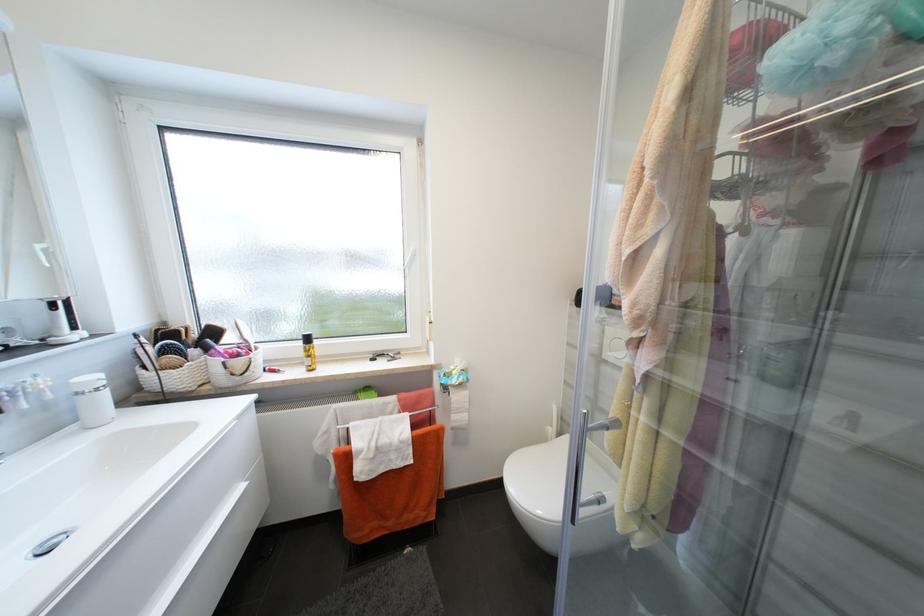
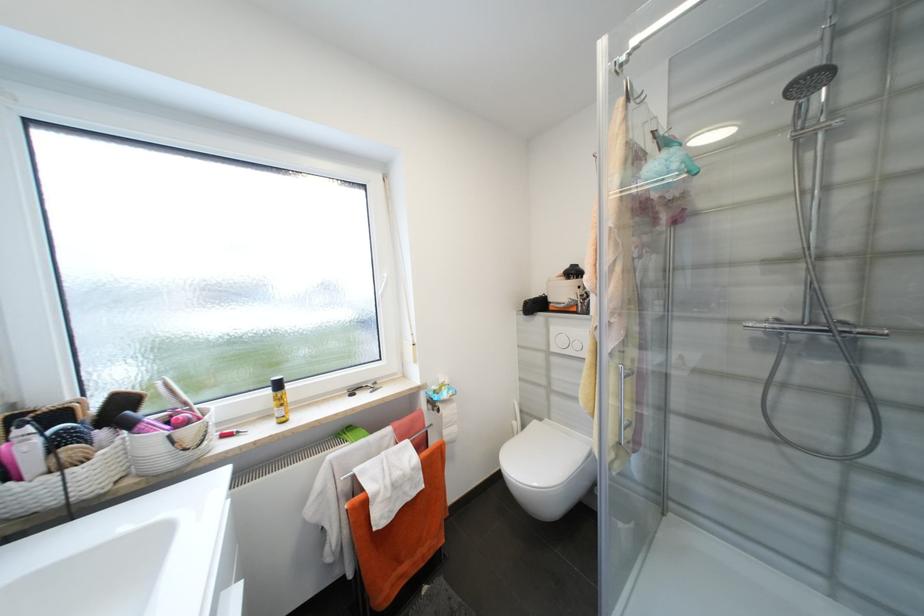
Find the pixel in the second image that matches (213,350) in the first image.

(134, 427)